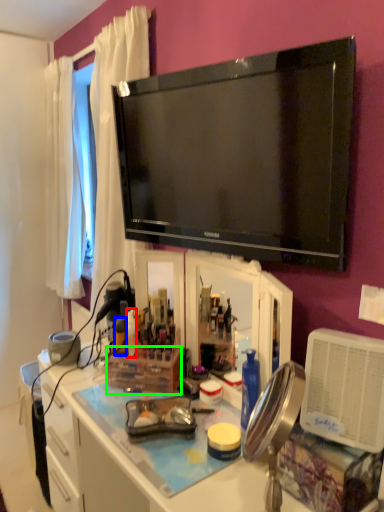
Question: Which object is positioned closest to bottle (highlighted by a red box)? Select from bottle (highlighted by a blue box) and box (highlighted by a green box).

Choices:
 (A) bottle
 (B) box

Answer: (A)